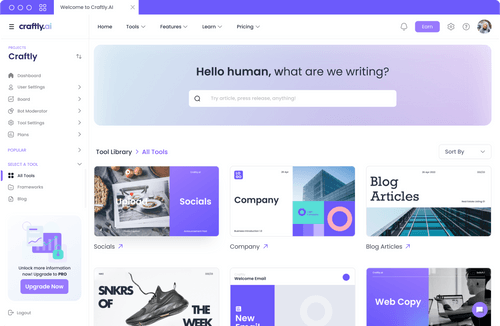
Find the location of a particular element. picture is located at coordinates (141, 217), (164, 308), (324, 180), (425, 218), (451, 304), (43, 242), (483, 27).